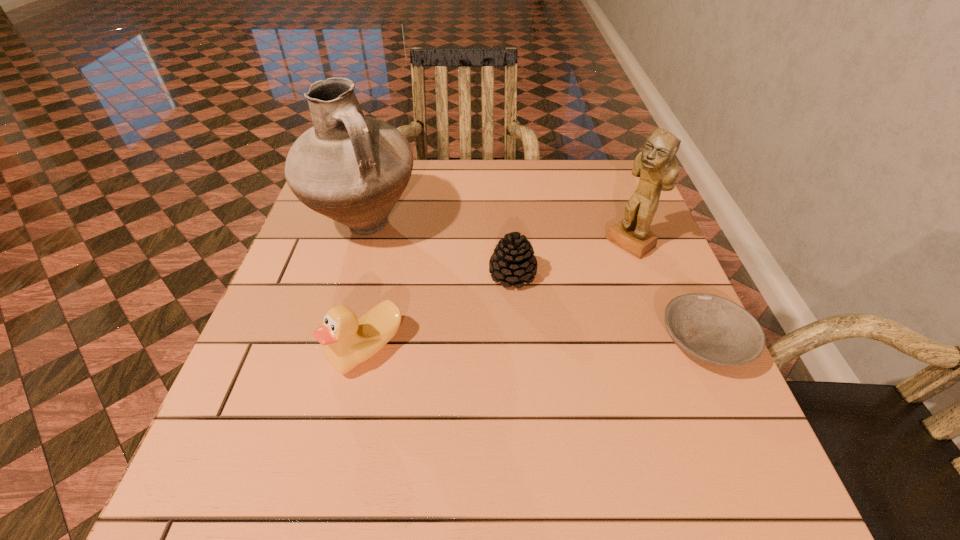
The image size is (960, 540). I want to click on duck, so [x=348, y=341].

Where is `bowl`? Image resolution: width=960 pixels, height=540 pixels. bowl is located at coordinates (711, 329).

Find the location of `pitcher`. pitcher is located at coordinates (351, 168).

Identify the location of pinecone. The width and height of the screenshot is (960, 540). (513, 261).

The image size is (960, 540). I want to click on figurine, so click(658, 170).

You are a GUI agent. You are given a task and a screenshot of the screen. Output one action in this format:
    pyautogui.click(x=<x>, y=<y>)
    Task: Click on the free space located at the beak of the duck
    Image resolution: width=960 pixels, height=540 pixels.
    Given the screenshot: What is the action you would take?
    pyautogui.click(x=269, y=348)

The image size is (960, 540). What are the coordinates of `vacant space located 0.140m at the beak of the duck` in the screenshot? It's located at (258, 348).

You are a GUI agent. You are given a task and a screenshot of the screen. Output one action in this format:
    pyautogui.click(x=<x>, y=<y>)
    Task: Click on the vacant position located 0.150m at the beak of the duck
    This screenshot has height=540, width=960.
    Given the screenshot: What is the action you would take?
    pyautogui.click(x=253, y=348)

This screenshot has height=540, width=960. Find the location of `free space located 0.050m on the left of the shortest object`. free space located 0.050m on the left of the shortest object is located at coordinates (634, 343).

Locate an element on the screen. The height and width of the screenshot is (540, 960). blank space located on the handle side of the pitcher is located at coordinates (442, 274).